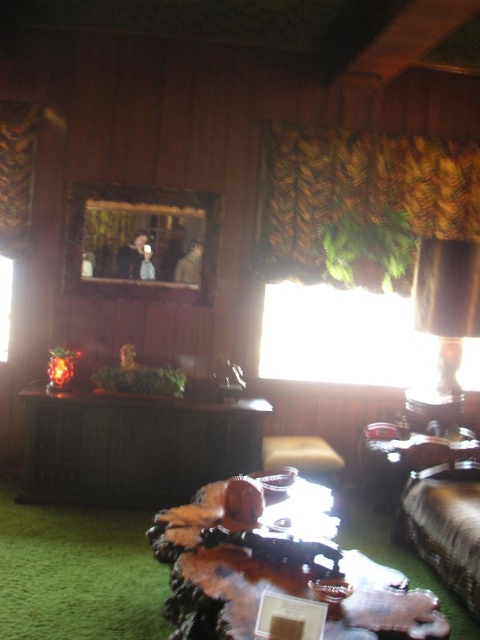
Can you confirm if green leafy fabric at upper right is taller than velvet brown couch at lower right?

Yes.

Which is behind, point (300, 241) or point (420, 545)?

The point (300, 241) is more distant.

This screenshot has height=640, width=480. I want to click on green leafy fabric at upper right, so click(360, 200).

Is wooden table at center below matte brown lampshade at upper right?

Yes.

Between wooden table at center and matte brown lampshade at upper right, which one has more height?

With more height is matte brown lampshade at upper right.

Does point (282, 563) come farther from viewer compared to point (451, 356)?

No.

This screenshot has width=480, height=640. Identify the location of wooden table at center. (277, 570).

Between dark wood cabinet at center and velvet brown couch at lower right, which one has less height?

With less height is velvet brown couch at lower right.

Where is `dark wood cabinet at center`? dark wood cabinet at center is located at coordinates (132, 445).

Where is `dark wood cabinet at center`? The width and height of the screenshot is (480, 640). dark wood cabinet at center is located at coordinates (132, 445).